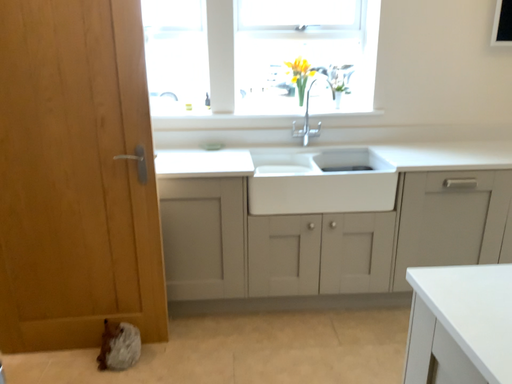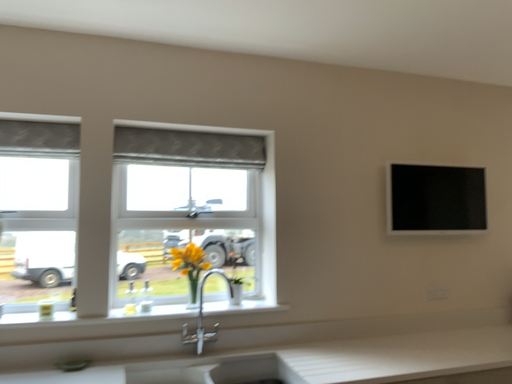
Question: How did the camera likely rotate when shooting the video?

Choices:
 (A) rotated left
 (B) rotated right

Answer: (B)